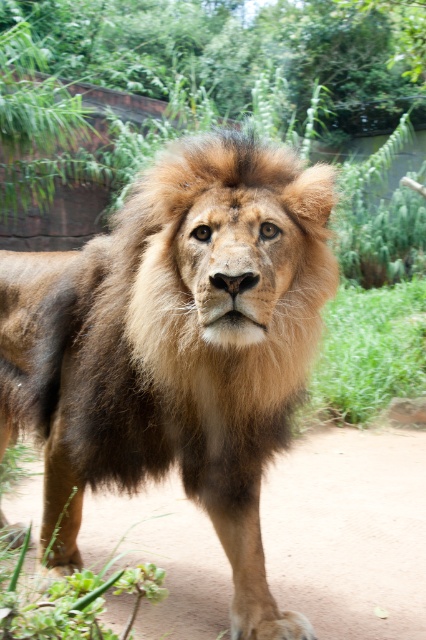
Question: Is brown fuzzy lion at center smaller than brown furry leg at center?

Choices:
 (A) yes
 (B) no

Answer: (B)

Question: Which object is farther from the camera taking this photo?

Choices:
 (A) brown furry leg at center
 (B) brown fuzzy lion at center

Answer: (A)

Question: Where is brown fuzzy lion at center located in relation to brown furry leg at center in the image?

Choices:
 (A) left
 (B) right

Answer: (A)

Question: In this image, where is brown fuzzy lion at center located relative to brown furry leg at center?

Choices:
 (A) below
 (B) above

Answer: (B)

Question: Among these points, which one is farthest from the camera?

Choices:
 (A) (322, 547)
 (B) (77, 397)

Answer: (A)

Question: Which point is closer to the camera taking this photo?

Choices:
 (A) (204, 428)
 (B) (406, 608)

Answer: (A)